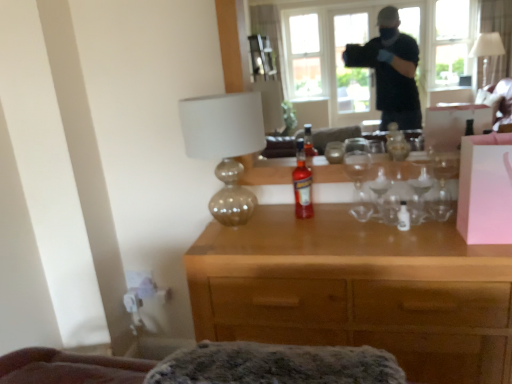
Question: Is transparent glass window at upper center aimed at matte gold lamp at center?

Choices:
 (A) no
 (B) yes

Answer: (B)

Question: Considering the relative sizes of transparent glass window at upper center and matte gold lamp at center in the image provided, is transparent glass window at upper center thinner than matte gold lamp at center?

Choices:
 (A) no
 (B) yes

Answer: (B)

Question: Does transparent glass window at upper center lie in front of matte gold lamp at center?

Choices:
 (A) no
 (B) yes

Answer: (B)

Question: Considering the relative sizes of transparent glass window at upper center and matte gold lamp at center in the image provided, is transparent glass window at upper center smaller than matte gold lamp at center?

Choices:
 (A) no
 (B) yes

Answer: (A)

Question: Is transparent glass window at upper center looking in the opposite direction of matte gold lamp at center?

Choices:
 (A) no
 (B) yes

Answer: (A)

Question: Does transparent glass window at upper center lie behind matte gold lamp at center?

Choices:
 (A) yes
 (B) no

Answer: (B)

Question: Is the depth of transparent glass window at upper center less than that of translucent glass bottle at center?

Choices:
 (A) no
 (B) yes

Answer: (B)

Question: Is transparent glass window at upper center at the right side of translucent glass bottle at center?

Choices:
 (A) yes
 (B) no

Answer: (A)

Question: Is transparent glass window at upper center wider than translucent glass bottle at center?

Choices:
 (A) yes
 (B) no

Answer: (A)

Question: Is transparent glass window at upper center far away from translucent glass bottle at center?

Choices:
 (A) no
 (B) yes

Answer: (A)

Question: From the image's perspective, does transparent glass window at upper center appear lower than translucent glass bottle at center?

Choices:
 (A) yes
 (B) no

Answer: (B)

Question: Is transparent glass window at upper center completely or partially outside of translucent glass bottle at center?

Choices:
 (A) no
 (B) yes

Answer: (B)

Question: Considering the relative sizes of matte gold lamp at center and pink matte box at right in the image provided, is matte gold lamp at center bigger than pink matte box at right?

Choices:
 (A) no
 (B) yes

Answer: (B)